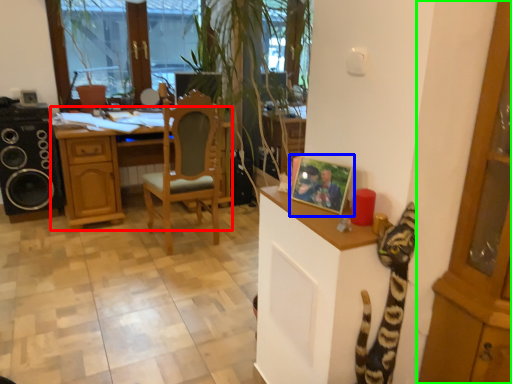
Question: Which object is positioned closest to desk (highlighted by a red box)? Select from picture frame (highlighted by a blue box) and cabinetry (highlighted by a green box).

Choices:
 (A) picture frame
 (B) cabinetry

Answer: (A)